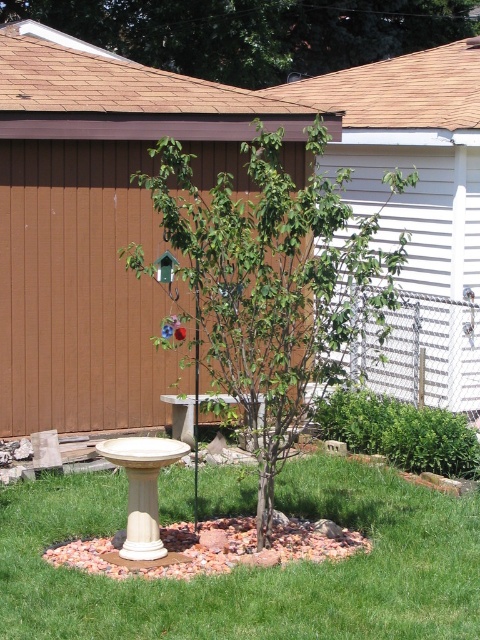
You are a bird looking for a place to land. You see the green grass at center and the green leafy tree at upper center. Which one is positioned to the left of the other?

The green grass at center is to the left of the green leafy tree at upper center.

You are a bird looking for a place to land. You see the green grass at center and the green matte tree at center. Which one is closer to you?

The green grass at center is closer because it is in front of the green matte tree at center.